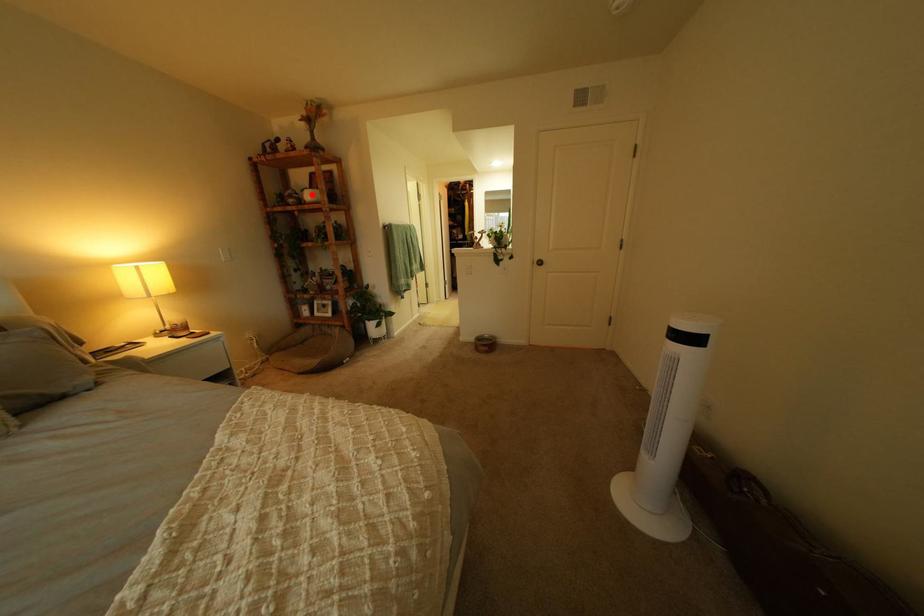
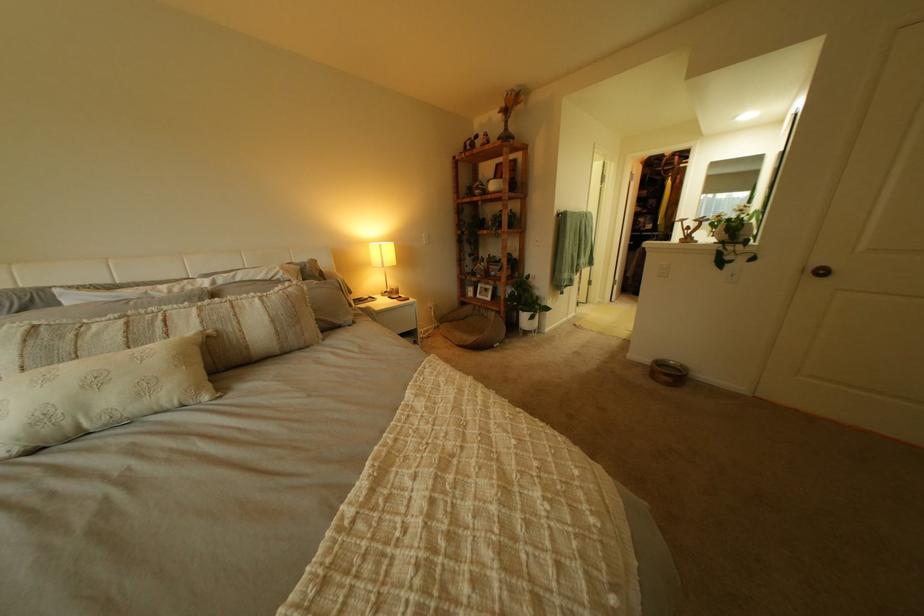
The point at the highlighted location is marked in the first image. Where is the corresponding point in the second image?

(497, 185)